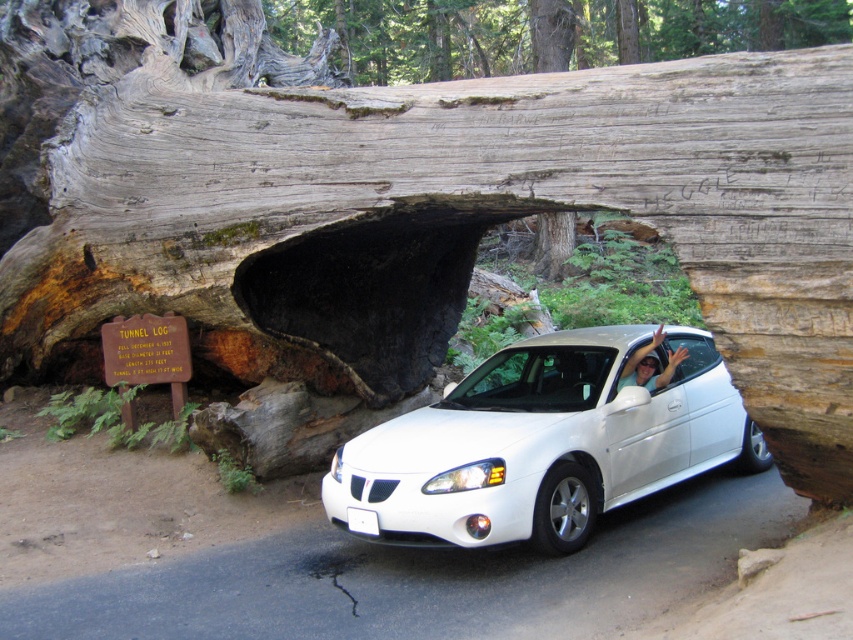
Question: Is white glossy hatchback at center thinner than white glossy car at center?

Choices:
 (A) yes
 (B) no

Answer: (B)

Question: Is white glossy hatchback at center to the left of white glossy car at center from the viewer's perspective?

Choices:
 (A) no
 (B) yes

Answer: (B)

Question: Can you confirm if white glossy hatchback at center is wider than white glossy car at center?

Choices:
 (A) no
 (B) yes

Answer: (B)

Question: Which point appears farthest from the camera in this image?

Choices:
 (A) (625, 372)
 (B) (381, 484)

Answer: (A)

Question: Among these points, which one is nearest to the camera?

Choices:
 (A) (456, 493)
 (B) (640, 365)

Answer: (A)